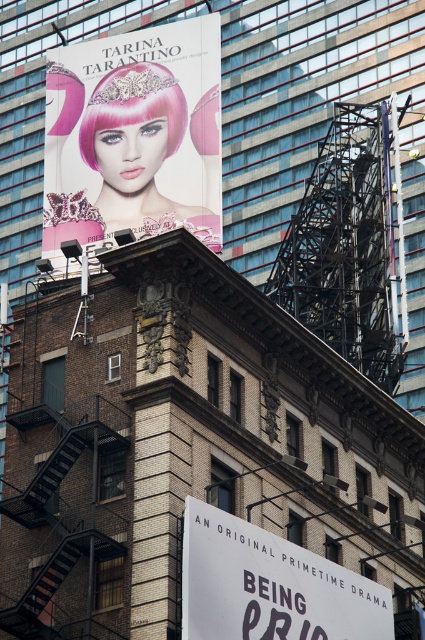
You are an urban planner assessing the city for accessibility. You notice the matte pink wig at upper left and the white paper sign at lower center. Which object is positioned higher up in the scene?

The matte pink wig at upper left is positioned higher up in the scene than the white paper sign at lower center because it has a greater height compared to the latter.

You are a delivery person who needs to hang a new sign that is 1.2 meters tall. You see the white paper sign at lower center and the black metal fire escape at lower left. Which object can the new sign be placed next to without blocking the view of the other sign?

The white paper sign at lower center is taller than the black metal fire escape at lower left. Since the new sign is 1.2 meters tall, it can be placed next to the black metal fire escape at lower left without blocking the view of the white paper sign at lower center because the fire escape is shorter.

You are a city planner assessing the visibility of signs in this area. The white paper sign at lower center and the pink matte wig at upper left are both important for public information. Considering their sizes, which one is more likely to be seen from a distance?

The white paper sign at lower center is much taller than the pink matte wig at upper left, making it more visible from a distance.